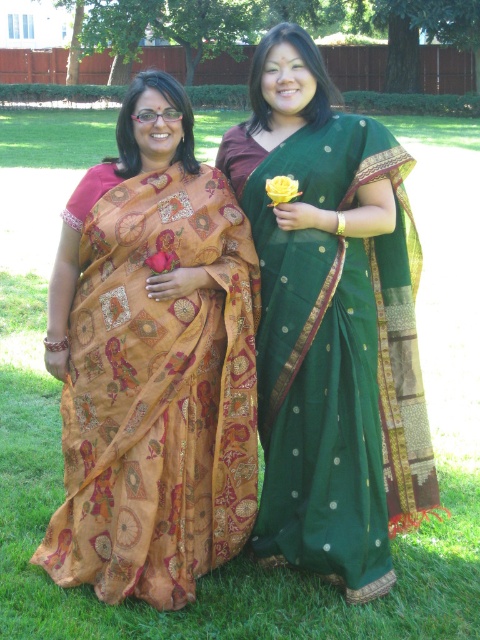
You are a photographer trying to capture both the matte orange sari at left and the green silk saree at center in a single frame. Based on their positions, which sari would appear closer to the camera?

The matte orange sari at left appears closer to the camera because it is positioned under the green silk saree at center, indicating it is in a lower plane and thus nearer to the viewer.

In the scene shown: You are standing at the origin point in the image. Which of the two points, point (109,308) or point (350,404), is closer to you?

Point (109,308) is closer to you because it is in front of point (350,404).